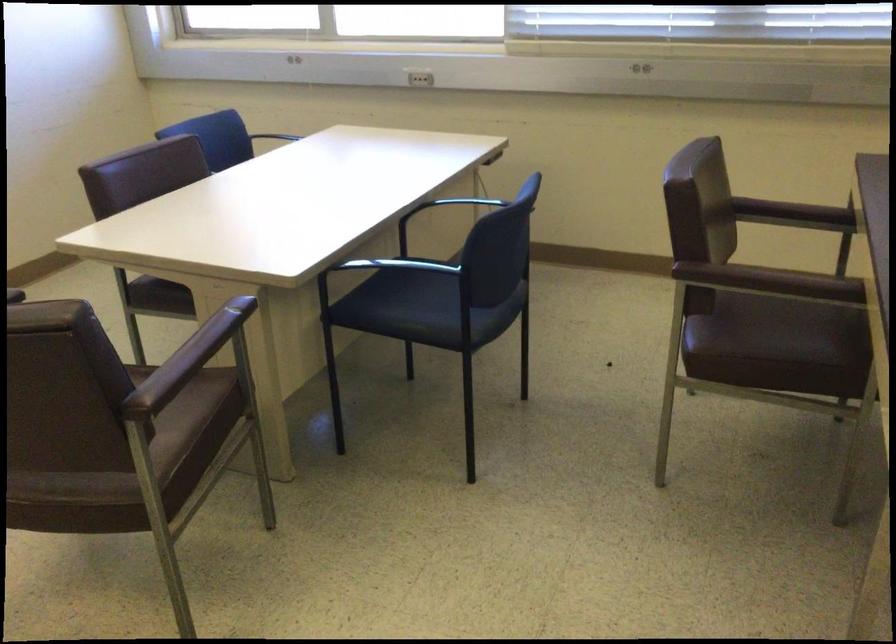
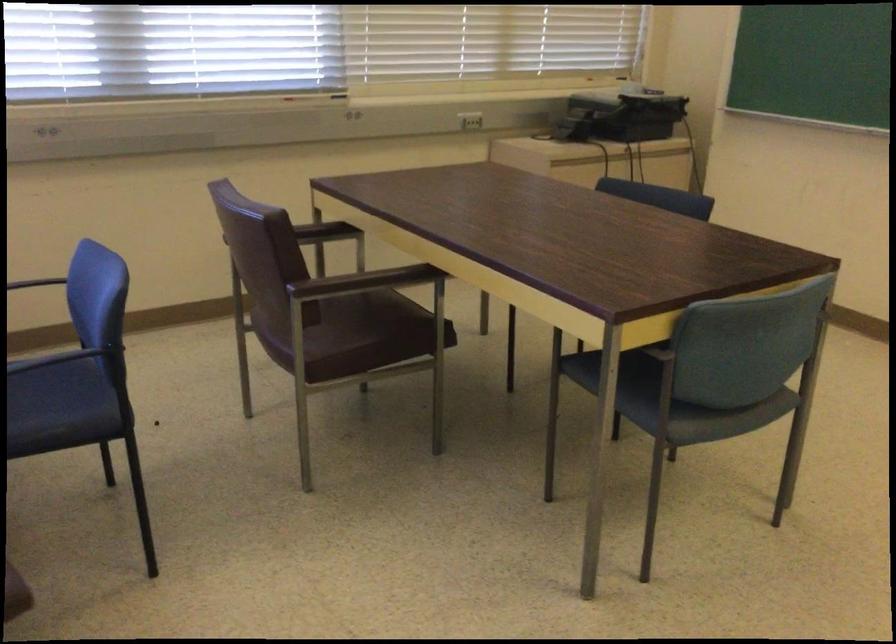
Where in the second image is the point corresponding to [600,198] from the first image?

(39, 283)